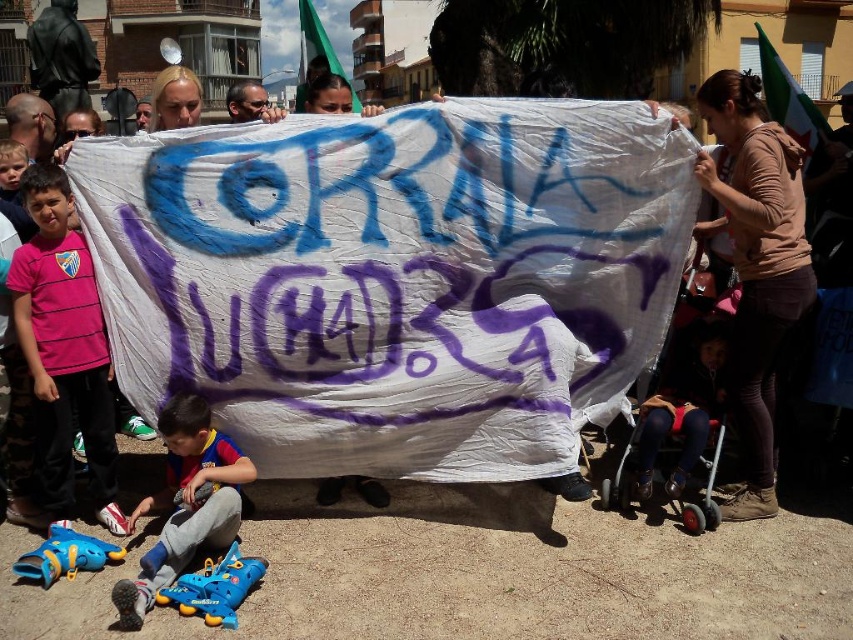
Question: Which object is the closest to the blue rubber roller skates at lower left?

Choices:
 (A) pink fabric shirt at left
 (B) dark blue denim pants at lower right

Answer: (A)

Question: Which is nearer to the blue rubber roller skates at lower left?

Choices:
 (A) pink fabric shirt at left
 (B) dark blue denim pants at lower right

Answer: (A)

Question: Does blue rubber roller skates at lower left lie behind dark blue denim pants at lower right?

Choices:
 (A) yes
 (B) no

Answer: (B)

Question: Estimate the real-world distances between objects in this image. Which object is closer to the blue rubber roller skates at lower left?

Choices:
 (A) pink fabric shirt at left
 (B) dark blue denim pants at lower right

Answer: (A)

Question: Is pink fabric shirt at left below dark blue denim pants at lower right?

Choices:
 (A) no
 (B) yes

Answer: (A)

Question: Observing the image, what is the correct spatial positioning of pink fabric shirt at left in reference to blue rubber roller skates at lower left?

Choices:
 (A) right
 (B) left

Answer: (B)